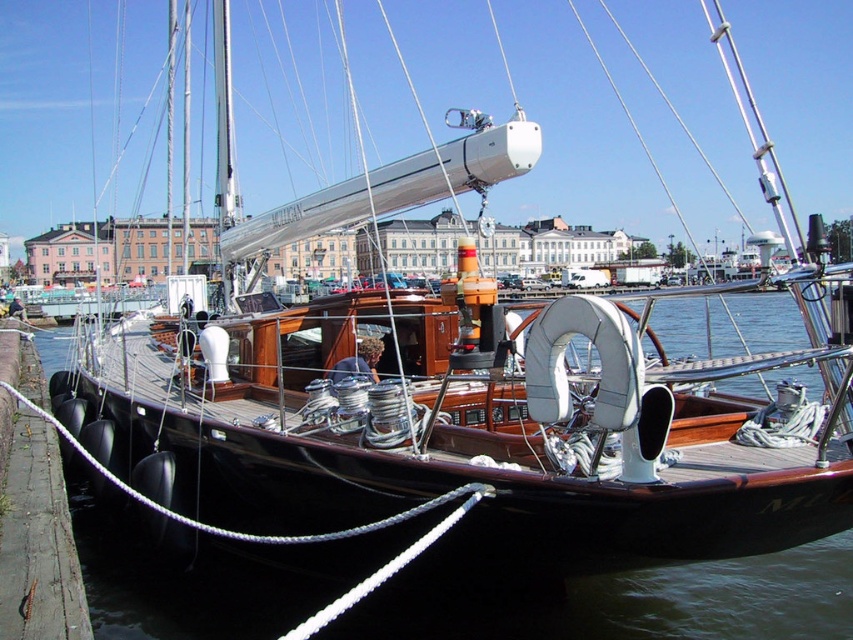
You are a sailor trying to board the black wood boat at center from the dock. Considering the height difference between the boat and the concrete at lower left, will you need a ladder or steps to climb aboard?

The black wood boat at center is taller than the concrete at lower left, so you will need a ladder or steps to climb aboard.

You are a delivery person needing to reach the black wood boat at center from the concrete at lower left. The delivery cart you drive has a maximum range of 35 meters before needing a recharge. Can you reach the boat without needing to recharge?

The distance between the black wood boat at center and the concrete at lower left is 38.45 meters, which is beyond the cart maximum range of 35 meters. Therefore, you cannot reach the boat without recharging.

You are standing on the dock and want to board the black wood boat at center. Which direction should you move relative to the concrete at lower left to reach it?

You should move to the right of the concrete at lower left to reach the black wood boat at center since the boat is positioned to the right of the concrete.